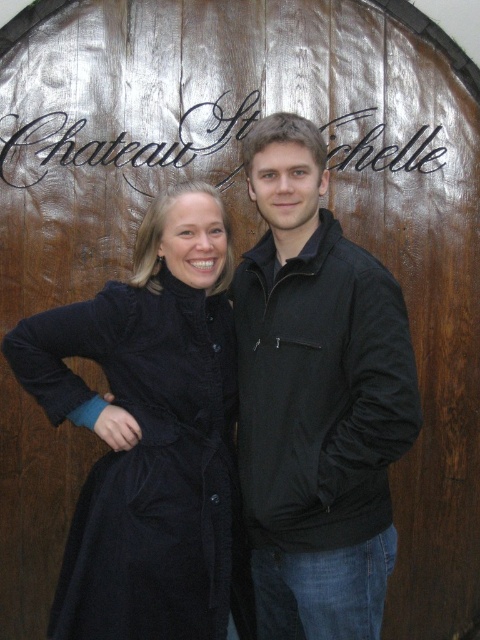
You are standing at the origin point of the image coordinate system. You want to move towards the point with coordinates point (247, 384). To reach this point, should you first pass through the point (119, 406)?

Point (247, 384) is behind point (119, 406), so yes, you must first pass through point (119, 406) to reach point (247, 384).

You are standing in front of the barrel and see a black matte jacket at center. Can you tell me what is located exactly at the point with coordinates (316,397)?

The black matte jacket at center is located exactly at the point with coordinates (316,397).

You are trying to decide which coat to wear for a casual evening out. Based on the image, which coat has a narrower silhouette between the black matte jacket at center and the velvet black coat at left?

The black matte jacket at center has a narrower silhouette compared to the velvet black coat at left, as it has a lesser width.